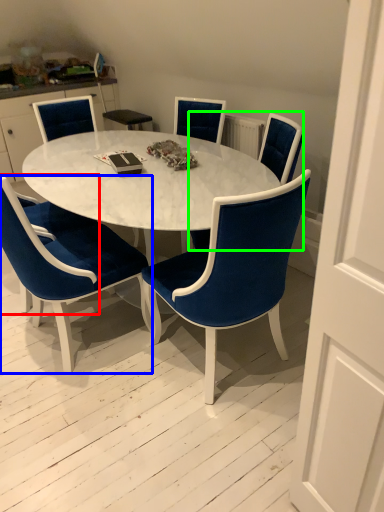
Question: Estimate the real-world distances between objects in this image. Which object is farther from armchair (highlighted by a red box), chair (highlighted by a blue box) or chair (highlighted by a green box)?

Choices:
 (A) chair
 (B) chair

Answer: (B)